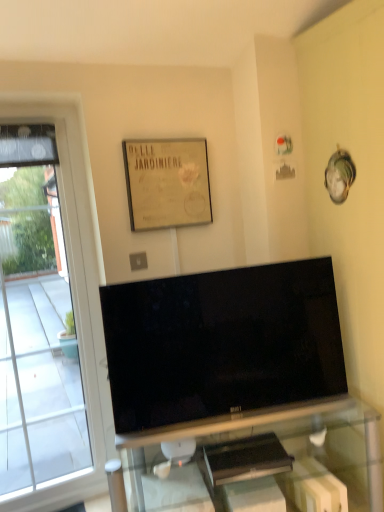
Question: Should I look upward or downward to see transparent glass window at left?

Choices:
 (A) up
 (B) down

Answer: (B)

Question: Can you confirm if transparent glass window at left is smaller than black glossy tv at center?

Choices:
 (A) no
 (B) yes

Answer: (A)

Question: Is black glossy tv at center completely or partially inside transparent glass window at left?

Choices:
 (A) yes
 (B) no

Answer: (B)

Question: From the image's perspective, does transparent glass window at left appear lower than black glossy tv at center?

Choices:
 (A) yes
 (B) no

Answer: (B)

Question: Is transparent glass window at left bigger than black glossy tv at center?

Choices:
 (A) no
 (B) yes

Answer: (B)

Question: Considering the relative sizes of transparent glass window at left and black glossy tv at center in the image provided, is transparent glass window at left wider than black glossy tv at center?

Choices:
 (A) no
 (B) yes

Answer: (B)

Question: From a real-world perspective, is transparent glass window at left below black glossy tv at center?

Choices:
 (A) yes
 (B) no

Answer: (B)

Question: From the image's perspective, is beige paper picture frame at upper center over transparent glass window at left?

Choices:
 (A) yes
 (B) no

Answer: (A)

Question: Is beige paper picture frame at upper center not inside transparent glass window at left?

Choices:
 (A) no
 (B) yes

Answer: (B)

Question: Can you confirm if beige paper picture frame at upper center is taller than transparent glass window at left?

Choices:
 (A) no
 (B) yes

Answer: (A)

Question: Is beige paper picture frame at upper center placed right next to transparent glass window at left?

Choices:
 (A) yes
 (B) no

Answer: (B)

Question: From a real-world perspective, does beige paper picture frame at upper center stand above transparent glass window at left?

Choices:
 (A) no
 (B) yes

Answer: (B)

Question: From a real-world perspective, is beige paper picture frame at upper center beneath transparent glass window at left?

Choices:
 (A) yes
 (B) no

Answer: (B)

Question: Is beige paper picture frame at upper center oriented towards black glossy tv at center?

Choices:
 (A) no
 (B) yes

Answer: (A)